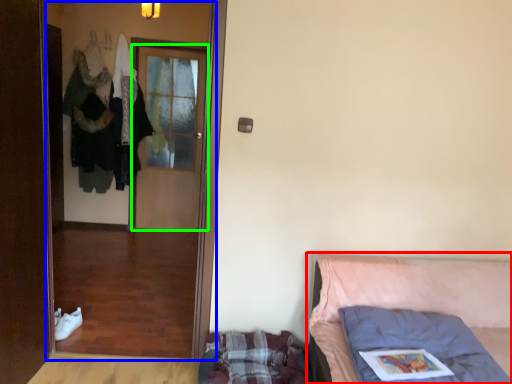
Question: Based on their relative distances, which object is nearer to furniture (highlighted by a red box)? Choose from screen door (highlighted by a blue box) and door (highlighted by a green box).

Choices:
 (A) screen door
 (B) door

Answer: (B)